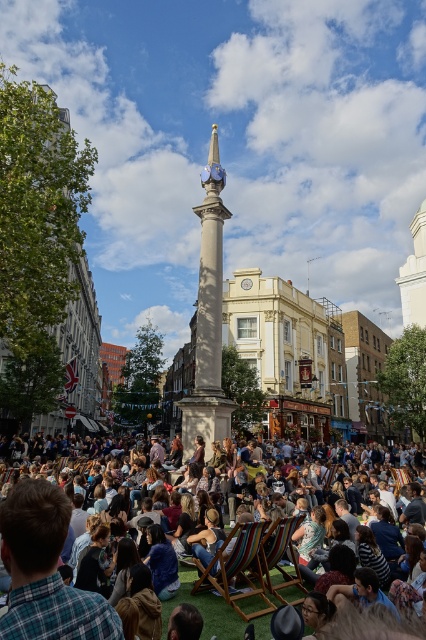
Question: Is smooth stone column at center to the left of multicolored wood deck chair at center from the viewer's perspective?

Choices:
 (A) no
 (B) yes

Answer: (B)

Question: Which point is closer to the camera taking this photo?

Choices:
 (A) (224, 596)
 (B) (296, 563)

Answer: (A)

Question: Which point is farther to the camera?

Choices:
 (A) (284, 532)
 (B) (62, 524)

Answer: (A)

Question: Is smooth stone column at center smaller than multicolored striped deck chairs at center?

Choices:
 (A) no
 (B) yes

Answer: (B)

Question: Based on their relative distances, which object is nearer to the multicolored wood deck chair at center?

Choices:
 (A) smooth stone column at center
 (B) multicolored striped deck chairs at center

Answer: (B)

Question: Does smooth stone column at center have a lesser width compared to multicolored striped deck chairs at center?

Choices:
 (A) yes
 (B) no

Answer: (A)